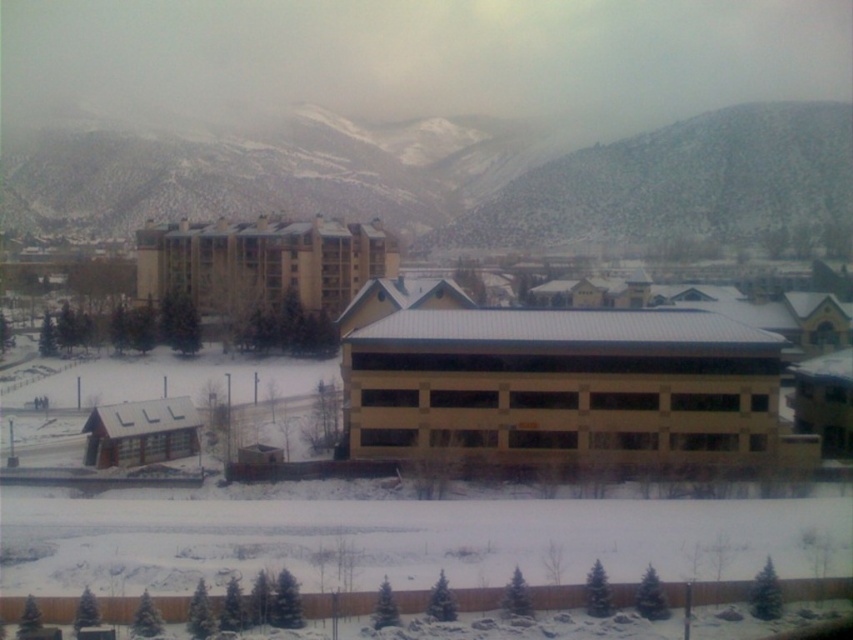
Question: Which point is closer to the camera?

Choices:
 (A) (223, 227)
 (B) (397, 452)
 (C) (798, 198)

Answer: (B)

Question: Which point is closer to the camera?

Choices:
 (A) beige concrete hotel at center
 (B) beige concrete parking garage at center

Answer: (B)

Question: Which point appears closest to the camera in this image?

Choices:
 (A) (329, 221)
 (B) (772, 129)

Answer: (A)

Question: Can you confirm if beige concrete parking garage at center is positioned to the right of beige concrete hotel at center?

Choices:
 (A) yes
 (B) no

Answer: (A)

Question: Does snow-covered mountain at upper center appear under beige concrete hotel at center?

Choices:
 (A) yes
 (B) no

Answer: (B)

Question: Does beige concrete hotel at center have a smaller size compared to matte brown cabin at lower left?

Choices:
 (A) yes
 (B) no

Answer: (B)